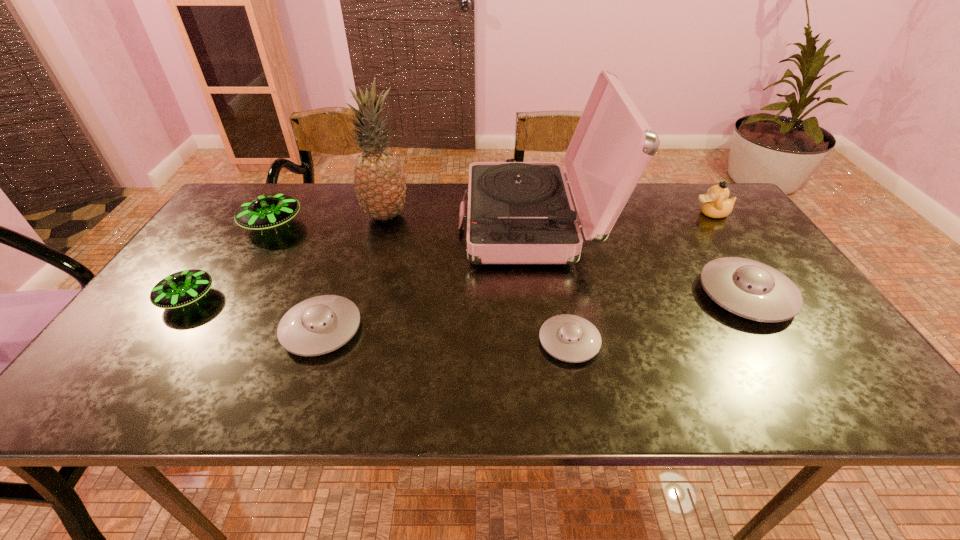
This screenshot has width=960, height=540. In order to click on free space between the tallest saucer and the smaller green saucer in this screenshot , I will do pyautogui.click(x=230, y=261).

Find the location of a particular element. free space between the smaller green saucer and the pineapple is located at coordinates (287, 257).

At what (x,y) coordinates should I click in order to perform the action: click on vacant area that lies between the nearer green saucer and the pineapple. Please return your answer as a coordinate pair (x, y). The height and width of the screenshot is (540, 960). Looking at the image, I should click on (287, 257).

Locate an element on the screen. The image size is (960, 540). vacant space that is in between the record player and the tan duckling is located at coordinates point(623,218).

Image resolution: width=960 pixels, height=540 pixels. What are the coordinates of `unoccupied area between the biggest gray saucer and the smaller green saucer` in the screenshot? It's located at (467, 296).

Locate an element on the screen. The height and width of the screenshot is (540, 960). free space between the leftmost gray saucer and the shortest saucer is located at coordinates (445, 335).

At what (x,y) coordinates should I click in order to perform the action: click on vacant space that's between the shortest object and the pineapple. Please return your answer as a coordinate pair (x, y). This screenshot has width=960, height=540. Looking at the image, I should click on (477, 279).

Identify which object is the second closest to the second gray saucer from right to left. Please provide its 2D coordinates. Your answer should be formatted as a tuple, i.e. [(x, y)], where the tuple contains the x and y coordinates of a point satisfying the conditions above.

[(748, 288)]

Locate an element on the screen. This screenshot has width=960, height=540. object that is the sixth closest to the fourth saucer from left to right is located at coordinates (268, 211).

At what (x,y) coordinates should I click in order to perform the action: click on saucer that stands as the closest to the sixth shortest object. Please return your answer as a coordinate pair (x, y). Looking at the image, I should click on (748, 288).